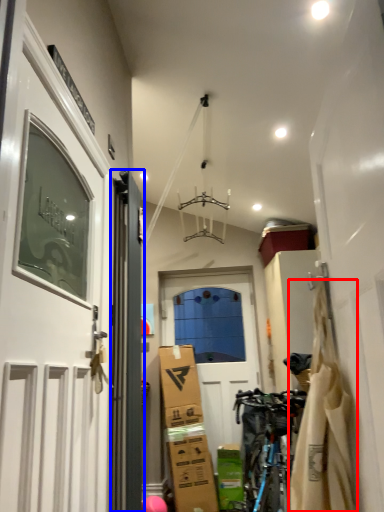
Question: Which of the following is the closest to the observer, material (highlighted by a red box) or door (highlighted by a blue box)?

Choices:
 (A) material
 (B) door

Answer: (A)